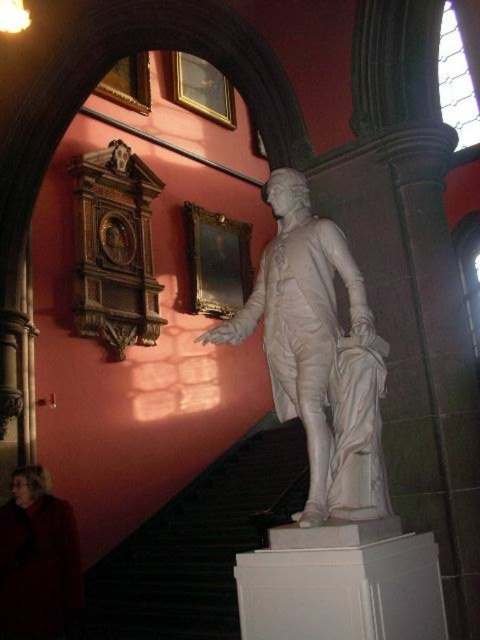
You are an art curator planning to move the velvet red coat at lower left to a different location. To do so, you need to walk around the black marble stairs at center. Is there enough space to move around the stairs without touching them?

The velvet red coat at lower left is positioned above the black marble stairs at center, so moving around the stairs should be possible as they are not directly blocking the coat. However, the exact space availability depends on the surrounding area not described here.

You are standing at the entrance of the museum and see the white marble statue at center and the black marble stairs at center. Which object is positioned to the right side from your perspective?

The white marble statue at center is positioned to the right of the black marble stairs at center, so the white marble statue at center is on the right side.

You are standing in the museum and looking at the statue. There are two points marked on the floor in front of the statue. One is at coordinates point (145, 634) and the other is at point (29, 632). Which point is closer to you?

Point (145, 634) is further to the viewer than point (29, 632), so the point closer to you is point (29, 632).